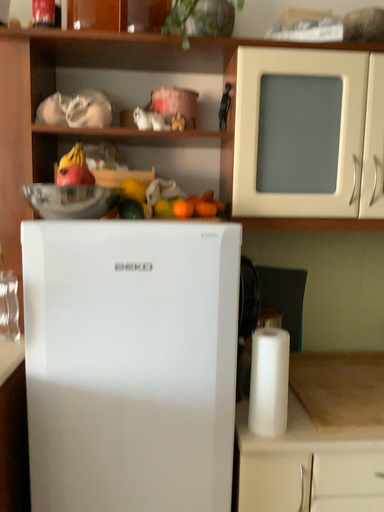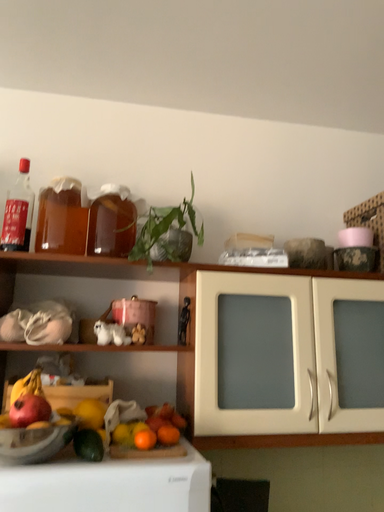
Question: How did the camera likely rotate when shooting the video?

Choices:
 (A) rotated left
 (B) rotated right

Answer: (B)